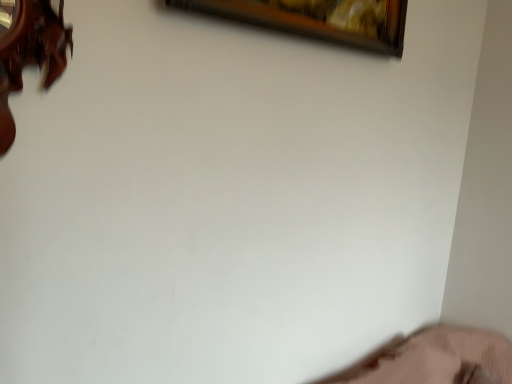
At what (x,y) coordinates should I click in order to perform the action: click on gold-framed picture at upper center. Please return your answer as a coordinate pair (x, y). This screenshot has width=512, height=384. Looking at the image, I should click on [x=318, y=19].

Image resolution: width=512 pixels, height=384 pixels. Describe the element at coordinates (318, 19) in the screenshot. I see `gold-framed picture at upper center` at that location.

This screenshot has width=512, height=384. What are the coordinates of `gold-framed picture at upper center` in the screenshot? It's located at (318, 19).